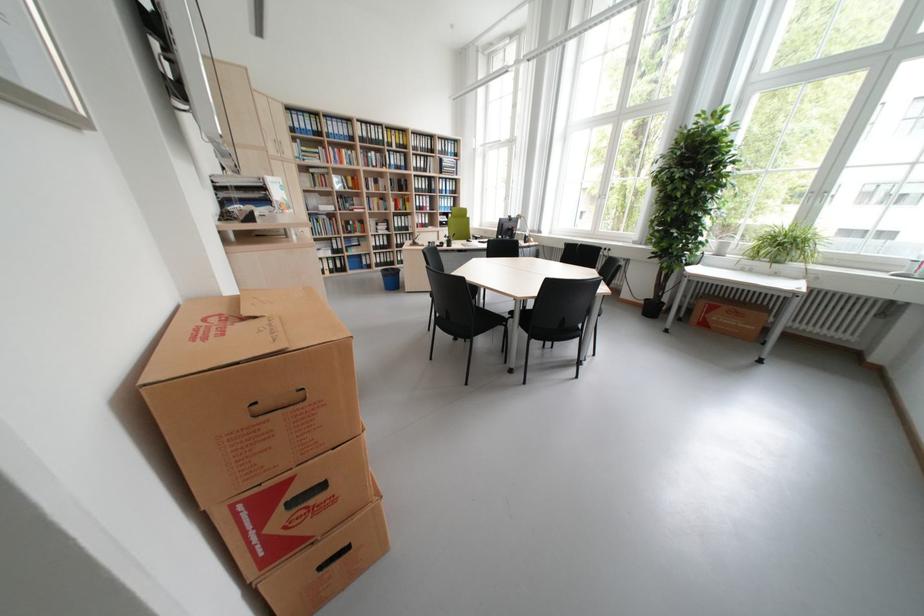
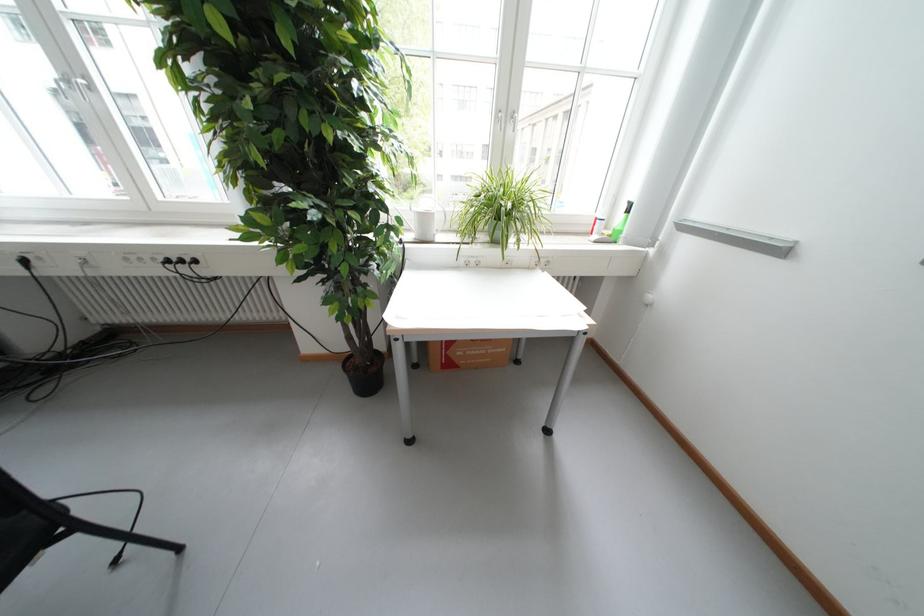
In the second image, find the point that corresponds to (792,249) in the first image.

(508, 217)